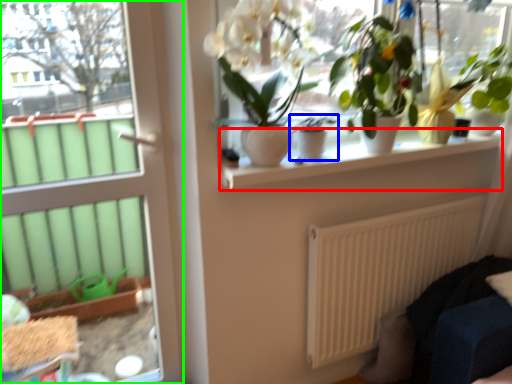
Question: Which object is positioned closest to window sill (highlighted by a red box)? Select from houseplant (highlighted by a blue box) and door (highlighted by a green box).

Choices:
 (A) houseplant
 (B) door

Answer: (A)